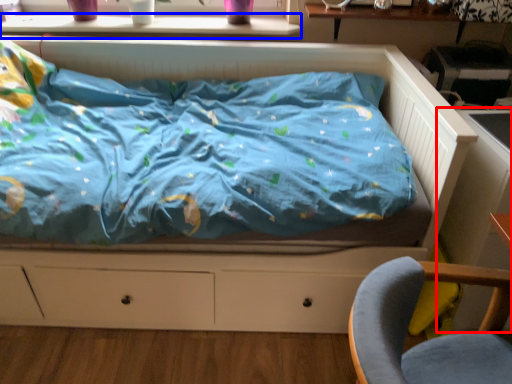
Question: Which point is closer to the camera, table (highlighted by a red box) or window sill (highlighted by a blue box)?

Choices:
 (A) table
 (B) window sill

Answer: (A)